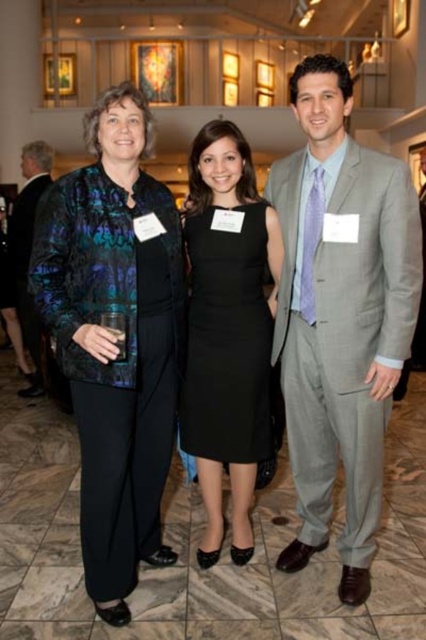
You are a photographer setting up for a group photo. You need to position a spotlight above the gray suit at center and another spotlight above the matte black suit at left. Which spotlight should be placed higher?

The spotlight above the matte black suit at left should be placed higher since the gray suit at center is positioned below the matte black suit at left.

You are a photographer trying to capture a candid shot of the person wearing a velvet black pantsuit. The room has a grid of lights arranged in a 5x5 pattern. The lights are spaced 1 meter apart both horizontally and vertically. You are standing at position point (x=115, y=339). Can you determine if you are directly under one of the lights?

The point (x=115, y=339) corresponds to the location of the velvet black pantsuit at left. Since the lights are spaced 1 meter apart in a 5x5 grid, unless the grid is aligned precisely with the coordinates provided, it is uncertain whether you are directly under a light. However, the coordinates given do not provide enough information about the grid alignment to confirm this.